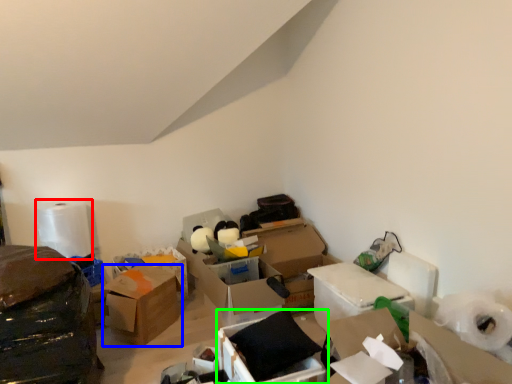
Question: Which is farther away from toilet paper (highlighted by a red box)? box (highlighted by a blue box) or box (highlighted by a green box)?

Choices:
 (A) box
 (B) box

Answer: (B)